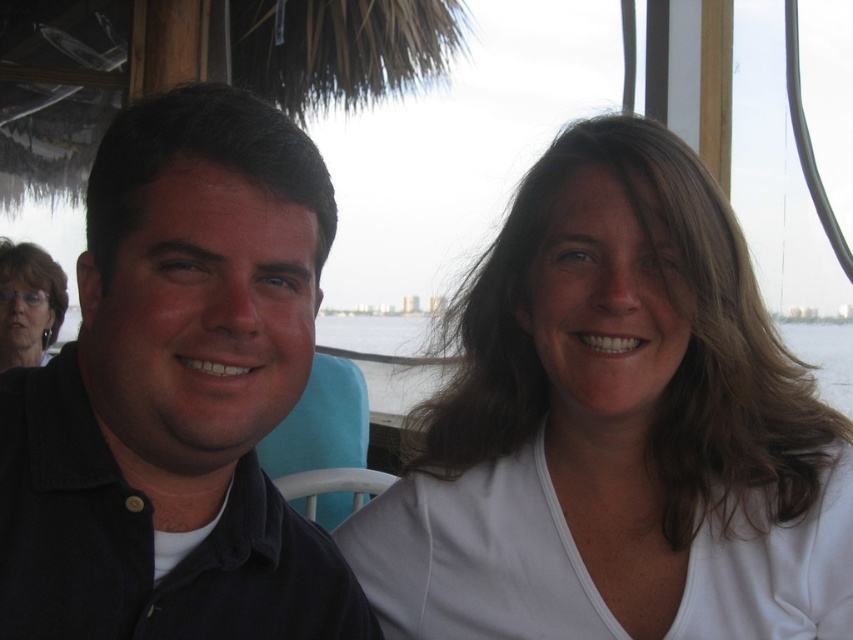
You are a photographer trying to capture the scene where the black matte shirt at left and the clear water at upper center are both visible. Based on their positions, which object is closer to the left edge of the photo?

The black matte shirt at left is positioned on the left side of clear water at upper center, so it is closer to the left edge of the photo.

You are a photographer trying to determine the best angle to capture both the black matte shirt at left and the matte black hair at upper left in the same frame. Based on their positions, which object should you focus on first to ensure both are in the frame?

The black matte shirt at left is positioned under matte black hair at upper left. To capture both in the frame, focus on the matte black hair at upper left first, as it is higher up, and adjust the angle to include the shirt below it.

You are a photographer trying to capture a group photo of the two people in the scene. The camera you are using has a limited frame size. Given that the white matte shirt at center is wider than the matte black hair at upper left, which object should you adjust your focus to ensure both are fully within the frame?

Since the white matte shirt at center is wider than the matte black hair at upper left, you should adjust your focus to accommodate the wider white matte shirt at center to ensure both objects are fully within the frame.